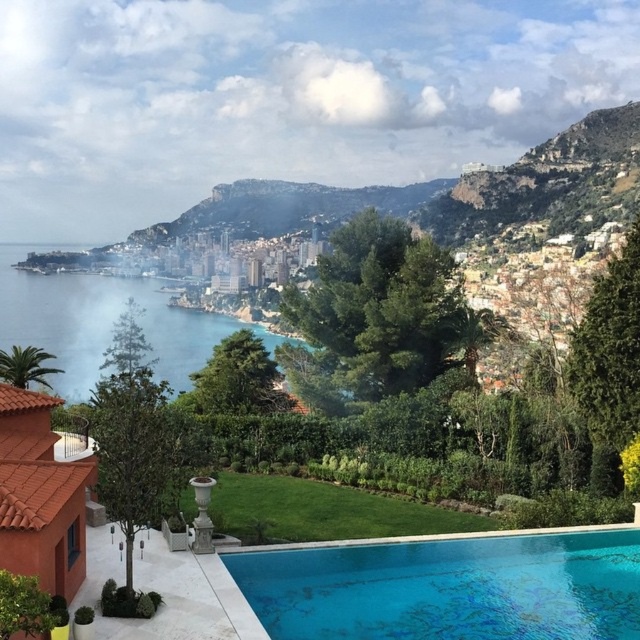
Question: Which point is closer to the camera?

Choices:
 (A) blue glassy swimming pool at lower center
 (B) clear blue water at center

Answer: (A)

Question: Which of the following is the closest to the observer?

Choices:
 (A) (x=189, y=352)
 (B) (x=483, y=608)

Answer: (B)

Question: Is blue glassy swimming pool at lower center wider than clear blue water at center?

Choices:
 (A) yes
 (B) no

Answer: (B)

Question: Does blue glassy swimming pool at lower center have a greater width compared to clear blue water at center?

Choices:
 (A) no
 (B) yes

Answer: (A)

Question: Is blue glassy swimming pool at lower center to the left of clear blue water at center from the viewer's perspective?

Choices:
 (A) no
 (B) yes

Answer: (A)